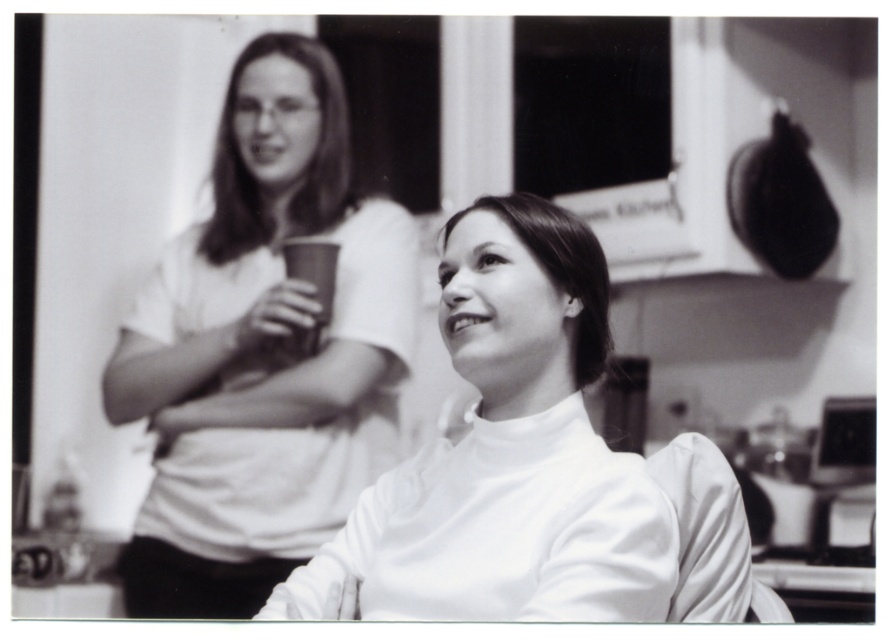
You are a photographer who wants to capture a closeup of the white matte turtleneck at center without including the matte white shirt at upper left in the frame. Is this possible given their positions?

The matte white shirt at upper left is above the white matte turtleneck at center, so if you position the camera to focus on the lower part where the white matte turtleneck at center is located while avoiding the upper area, it should be possible to exclude the matte white shirt at upper left from the frame.

You are a photographer setting up a shoot in this kitchen. You need to position a light source between the matte white shirt at upper left and the white matte turtleneck at center. What is the minimum distance the light source should be placed from each object to ensure it is equidistant from both?

The minimum distance to place the light source equidistant from both the matte white shirt at upper left and the white matte turtleneck at center would be halfway between them, which is 0.595 meters from each object.

You are standing in a kitchen and see a point at coordinates (262, 352). Which object is this point located on?

The point at coordinates (262, 352) is located on the matte white shirt at upper left.